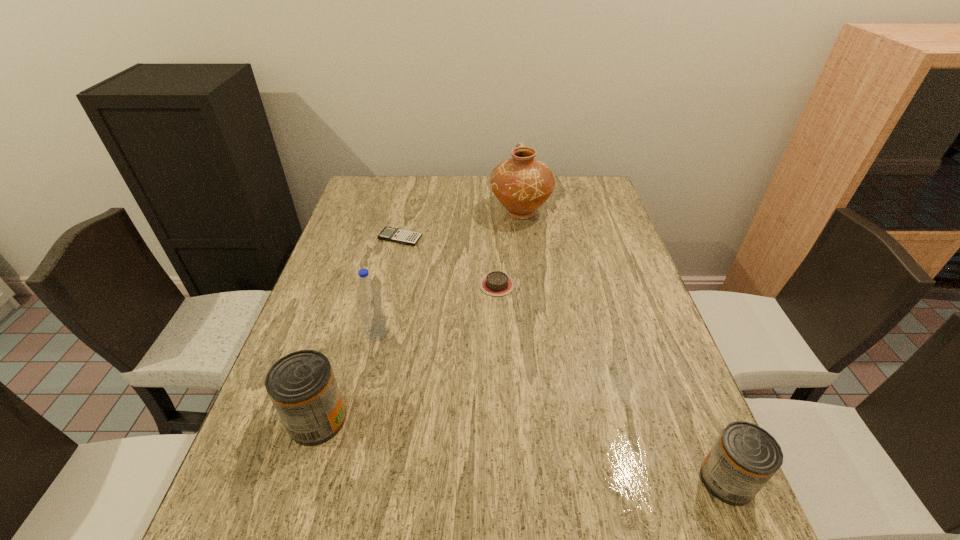
What are the coordinates of `object that can be found as the second closest to the fourth farthest object` in the screenshot? It's located at (497, 283).

Locate an element on the screen. The width and height of the screenshot is (960, 540). the third closest object to the chocolate cake is located at coordinates (372, 314).